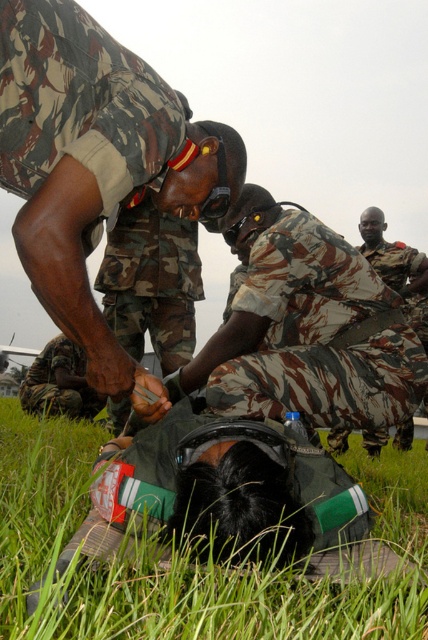
Question: Is camo uniform at center below camouflage uniform at center?

Choices:
 (A) no
 (B) yes

Answer: (A)

Question: Which object is closer to the camera taking this photo?

Choices:
 (A) camo uniform at center
 (B) green grass at lower center

Answer: (B)

Question: Does camo uniform at center appear on the left side of camouflage uniform at center?

Choices:
 (A) no
 (B) yes

Answer: (B)

Question: Which point appears farthest from the camera in this image?

Choices:
 (A) (404, 525)
 (B) (51, 97)
 (C) (288, 321)

Answer: (A)

Question: Is camo uniform at center thinner than camouflage uniform at center?

Choices:
 (A) yes
 (B) no

Answer: (A)

Question: Among these objects, which one is farthest from the camera?

Choices:
 (A) camouflage uniform at center
 (B) camo uniform at center

Answer: (A)